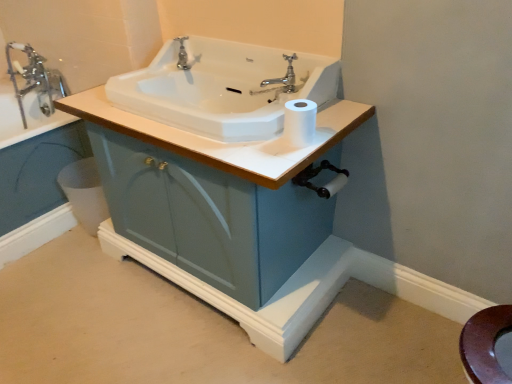
In order to click on vacant space in front of white matte toilet paper at upper center in this screenshot , I will do `click(287, 152)`.